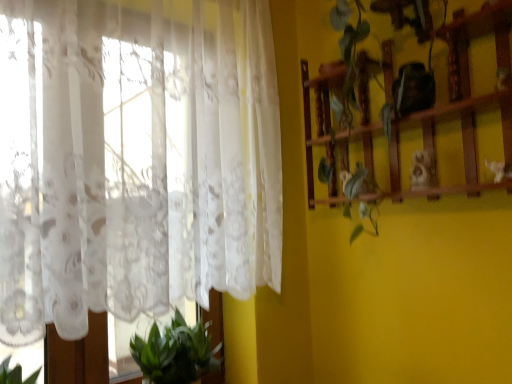
Question: From the image's perspective, is wooden shelf at right on top of green leafy plant at lower left?

Choices:
 (A) yes
 (B) no

Answer: (A)

Question: Is wooden shelf at right outside green leafy plant at lower left?

Choices:
 (A) yes
 (B) no

Answer: (A)

Question: Are wooden shelf at right and green leafy plant at lower left making contact?

Choices:
 (A) yes
 (B) no

Answer: (B)

Question: Is wooden shelf at right at the right side of green leafy plant at lower left?

Choices:
 (A) no
 (B) yes

Answer: (B)

Question: Is wooden shelf at right aimed at green leafy plant at lower left?

Choices:
 (A) yes
 (B) no

Answer: (B)

Question: Can you confirm if wooden shelf at right is wider than green leafy plant at lower left?

Choices:
 (A) yes
 (B) no

Answer: (B)

Question: Does green leafy plant at lower left have a lesser height compared to wooden shelf at right?

Choices:
 (A) no
 (B) yes

Answer: (B)

Question: Does green leafy plant at lower left appear on the right side of wooden shelf at right?

Choices:
 (A) no
 (B) yes

Answer: (A)

Question: Considering the relative sizes of green leafy plant at lower left and wooden shelf at right in the image provided, is green leafy plant at lower left wider than wooden shelf at right?

Choices:
 (A) yes
 (B) no

Answer: (A)

Question: From the image's perspective, is green leafy plant at lower left beneath wooden shelf at right?

Choices:
 (A) no
 (B) yes

Answer: (B)

Question: Considering the relative sizes of green leafy plant at lower left and wooden shelf at right in the image provided, is green leafy plant at lower left taller than wooden shelf at right?

Choices:
 (A) no
 (B) yes

Answer: (A)

Question: Is the depth of green leafy plant at lower left less than that of wooden shelf at right?

Choices:
 (A) yes
 (B) no

Answer: (B)

Question: Is white lace curtain at left aimed at green leafy plant at lower left?

Choices:
 (A) no
 (B) yes

Answer: (A)